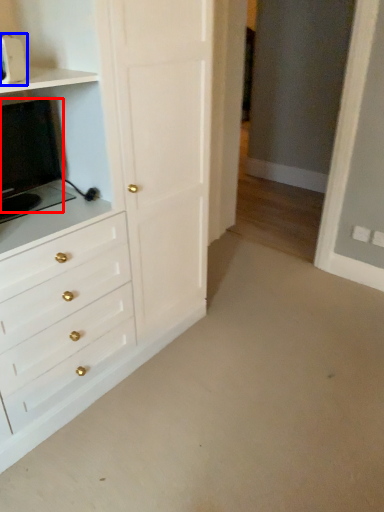
Question: Which object is closer to the camera taking this photo, appliance (highlighted by a red box) or appliance (highlighted by a blue box)?

Choices:
 (A) appliance
 (B) appliance

Answer: (B)